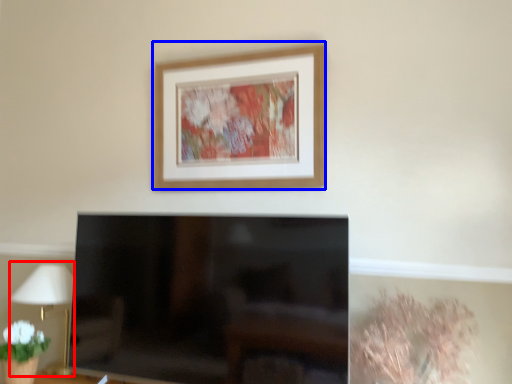
Question: Which object appears farthest to the camera in this image, table lamp (highlighted by a red box) or picture frame (highlighted by a blue box)?

Choices:
 (A) table lamp
 (B) picture frame

Answer: (A)